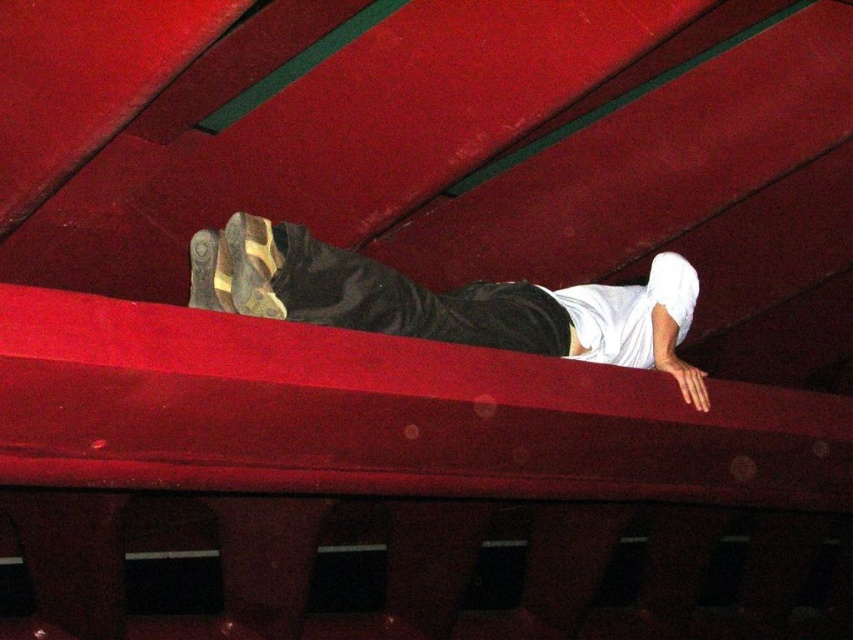
Question: Does smooth red beam at center have a lesser width compared to matte black pants at upper center?

Choices:
 (A) no
 (B) yes

Answer: (A)

Question: Which point is closer to the camera?

Choices:
 (A) smooth red beam at center
 (B) matte black pants at upper center

Answer: (A)

Question: Among these objects, which one is nearest to the camera?

Choices:
 (A) smooth red beam at center
 (B) matte black pants at upper center

Answer: (A)

Question: Can you confirm if smooth red beam at center is positioned to the left of matte black pants at upper center?

Choices:
 (A) no
 (B) yes

Answer: (A)

Question: Observing the image, what is the correct spatial positioning of smooth red beam at center in reference to matte black pants at upper center?

Choices:
 (A) left
 (B) right

Answer: (B)